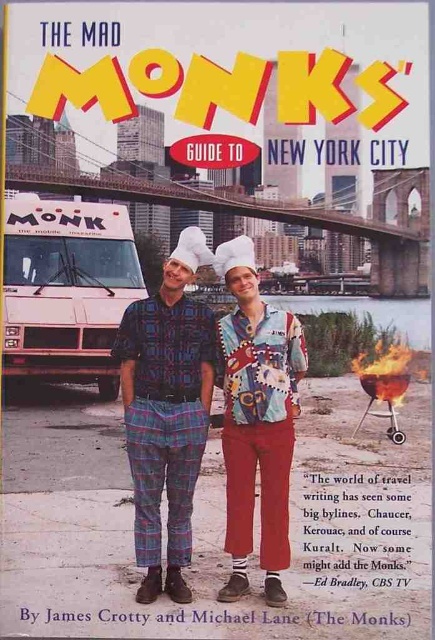
Question: Can you confirm if white plastic food truck at left is positioned to the right of printed fabric chef hat at center?

Choices:
 (A) no
 (B) yes

Answer: (A)

Question: Which of the following is the farthest from the observer?

Choices:
 (A) white plastic food truck at left
 (B) plaid fabric pants at center
 (C) printed fabric chef hat at center

Answer: (A)

Question: Observing the image, what is the correct spatial positioning of plaid fabric pants at center in reference to white plastic food truck at left?

Choices:
 (A) left
 (B) right

Answer: (B)

Question: Which point is closer to the camera?

Choices:
 (A) (300, 353)
 (B) (290, 312)
 (C) (56, 243)

Answer: (A)

Question: Can you confirm if white plastic food truck at left is wider than printed fabric chef hat at center?

Choices:
 (A) yes
 (B) no

Answer: (A)

Question: Among these objects, which one is farthest from the camera?

Choices:
 (A) printed fabric chef hat at center
 (B) white plastic food truck at left
 (C) plaid fabric pants at center

Answer: (B)